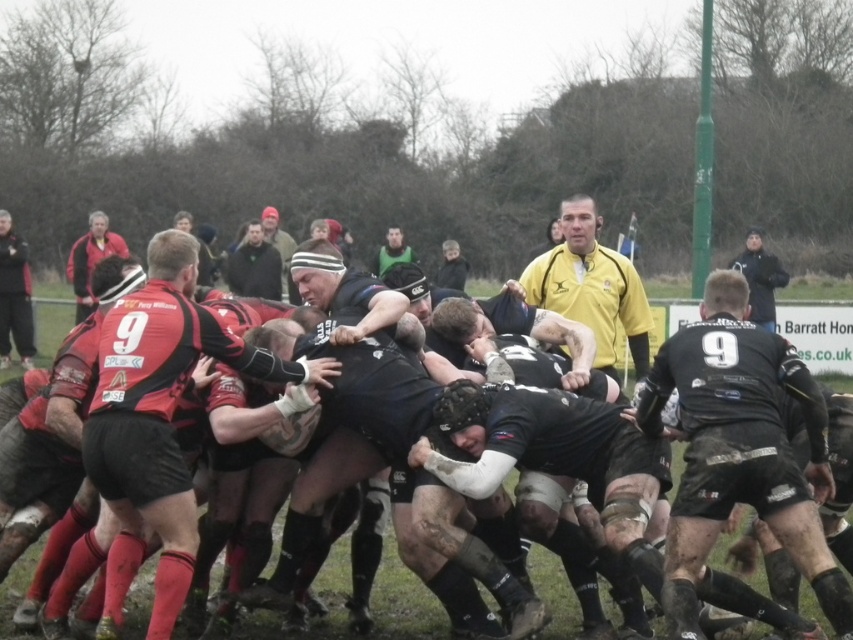
Is point (764, 464) more distant than point (194, 321)?

No, (764, 464) is closer to viewer.

Which of these two, black matte jersey at right or red jersey at center, stands taller?

red jersey at center is taller.

Who is more distant from viewer, (776, 340) or (111, 337)?

The point (776, 340) is more distant.

The image size is (853, 640). In order to click on black matte jersey at right in this screenshot , I will do `click(740, 449)`.

Does point (688, 392) come behind point (402, 253)?

No.

Is black matte jersey at right taller than green matte jersey at center?

No.

Between point (730, 435) and point (412, 256), which one is positioned behind?

The point (412, 256) is more distant.

Where is `black matte jersey at right`? Image resolution: width=853 pixels, height=640 pixels. black matte jersey at right is located at coordinates (740, 449).

Between red jersey at left and dark gray sweater at upper center, which one has more height?

red jersey at left

Is red jersey at left positioned before dark gray sweater at upper center?

No, red jersey at left is further to the viewer.

Between point (26, 353) and point (258, 292), which one is positioned behind?

Positioned behind is point (26, 353).

This screenshot has width=853, height=640. I want to click on red jersey at left, so click(15, 296).